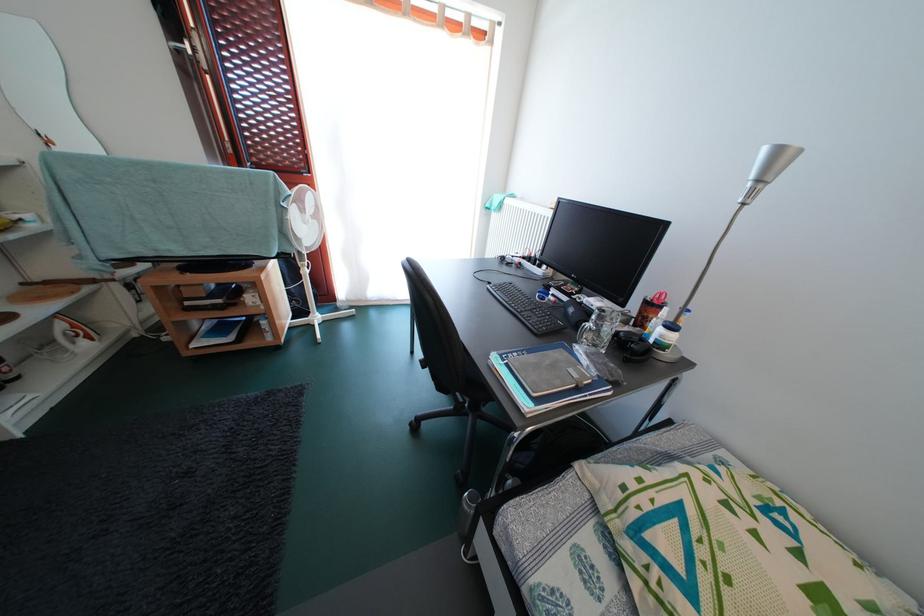
The image size is (924, 616). I want to click on glass mug handle, so (601, 355).